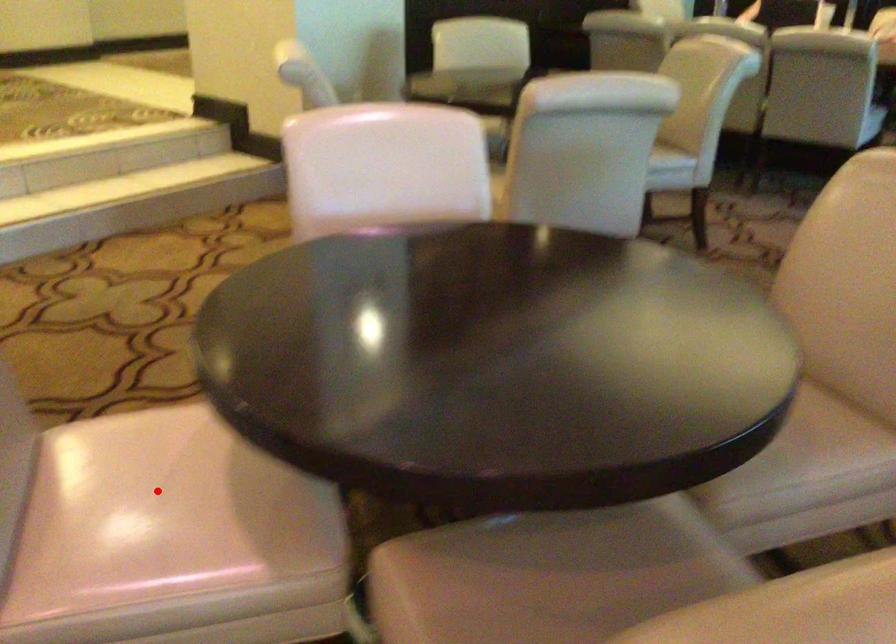
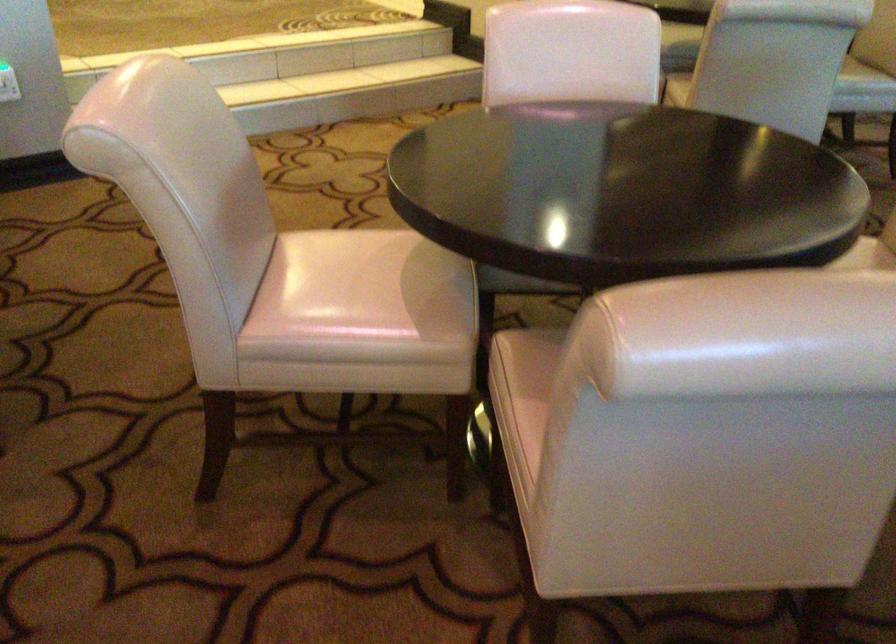
Where in the second image is the point corresponding to the highlighted location from the first image?

(347, 278)